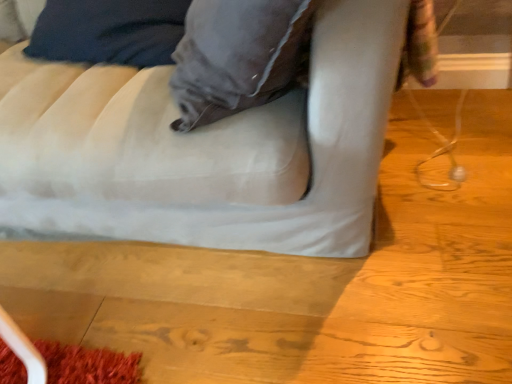
What do you see at coordinates (204, 149) in the screenshot? I see `white fabric couch at center` at bounding box center [204, 149].

Locate an element on the screen. The width and height of the screenshot is (512, 384). white fabric couch at center is located at coordinates (204, 149).

In order to face white fabric couch at center, should I rotate leftwards or rightwards?

Rotate your view right by about 0.271°.

What are the coordinates of `white fabric couch at center` in the screenshot? It's located at (204, 149).